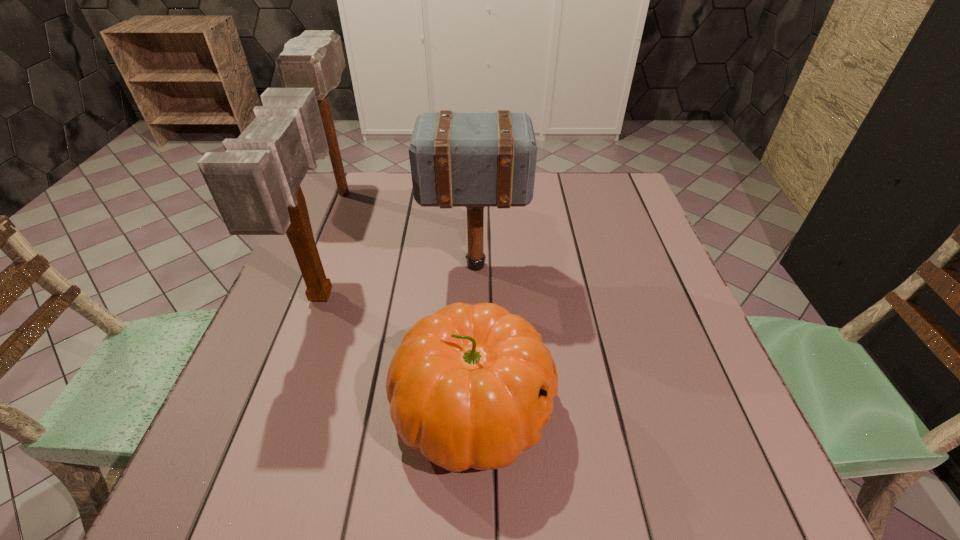
Identify the location of vacant space at the left edge of the desktop. (331, 270).

You are a GUI agent. You are given a task and a screenshot of the screen. Output one action in this format:
    pyautogui.click(x=<x>, y=<y>)
    Task: Click on the free space at the right edge
    
    Given the screenshot: What is the action you would take?
    pyautogui.click(x=620, y=220)

The image size is (960, 540). In order to click on free space at the far left corner in this screenshot , I will do `click(368, 174)`.

In the image, there is a desktop. Find the location of `free space at the far right corner`. free space at the far right corner is located at coordinates (585, 188).

Locate an element on the screen. The image size is (960, 540). free spot between the farthest object and the rightmost mallet is located at coordinates (409, 230).

You are a GUI agent. You are given a task and a screenshot of the screen. Output one action in this format:
    pyautogui.click(x=<x>, y=<y>)
    Task: Click on the vacant space in between the farthest object and the pumpkin
    
    Given the screenshot: What is the action you would take?
    pyautogui.click(x=408, y=300)

Locate an element on the screen. Image resolution: width=960 pixels, height=540 pixels. free space between the shortest object and the farthest object is located at coordinates (408, 300).

Locate an element on the screen. This screenshot has height=540, width=960. free point between the farthest mallet and the pumpkin is located at coordinates (408, 300).

You are a GUI agent. You are given a task and a screenshot of the screen. Output one action in this format:
    pyautogui.click(x=<x>, y=<y>)
    Task: Click on the object that stands as the third closest to the farthest object
    The width and height of the screenshot is (960, 540).
    Given the screenshot: What is the action you would take?
    pyautogui.click(x=471, y=386)

You are a GUI agent. You are given a task and a screenshot of the screen. Output one action in this format:
    pyautogui.click(x=<x>, y=<y>)
    Task: Click on the closest object to the shortest object
    The height and width of the screenshot is (540, 960).
    Given the screenshot: What is the action you would take?
    pyautogui.click(x=255, y=183)